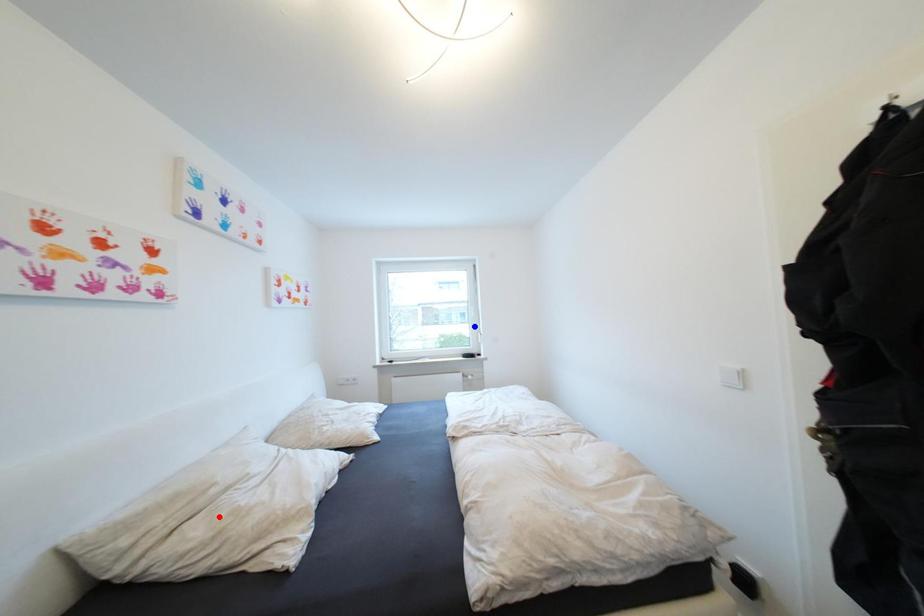
Question: In the image, two points are highlighted. Which point is nearer to the camera? Reply with the corresponding letter.

Choices:
 (A) blue point
 (B) red point

Answer: (B)